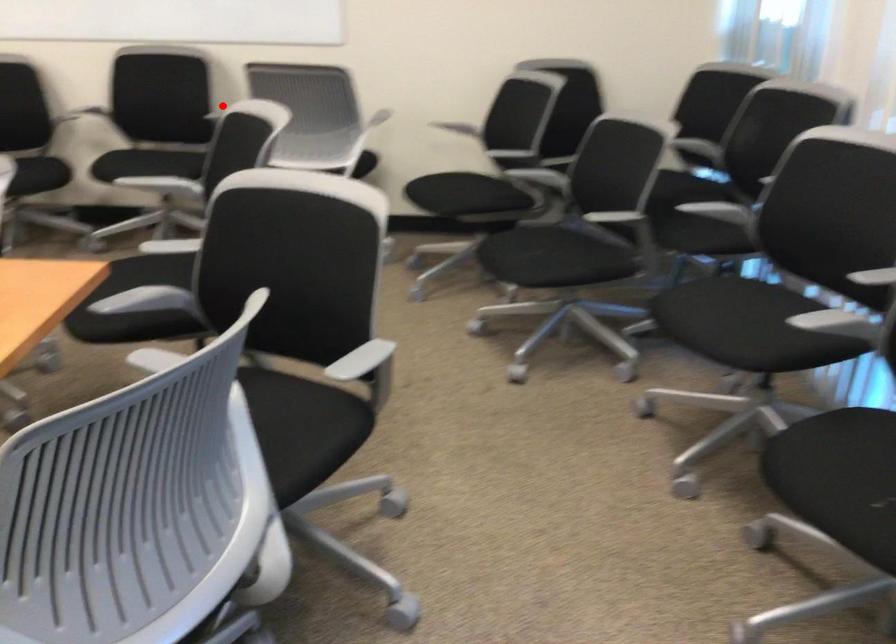
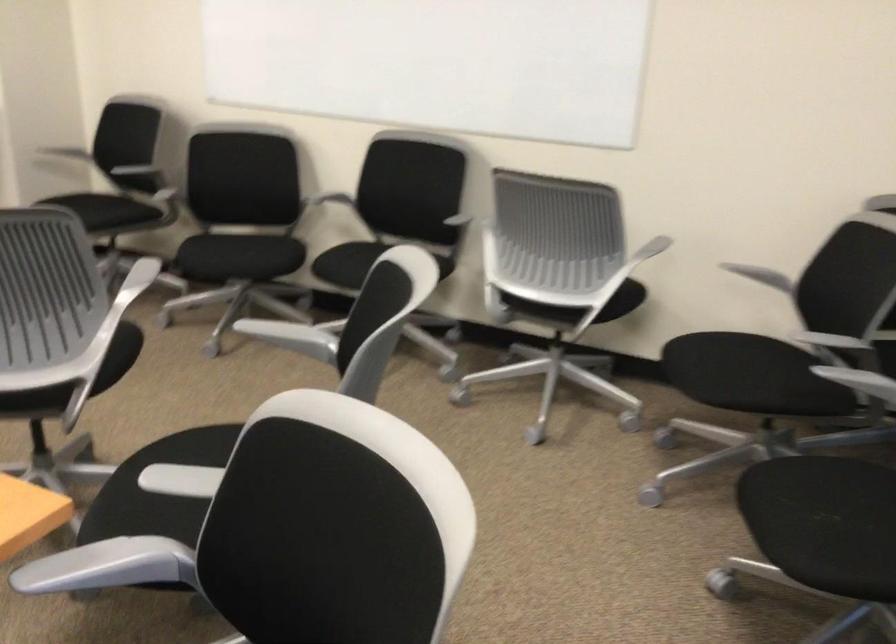
Question: I am providing you with two images of the same scene from different viewpoints. Given a red point in image1, look at the same physical point in image2. Is it:

Choices:
 (A) Closer to the viewpoint
 (B) Farther from the viewpoint

Answer: (A)